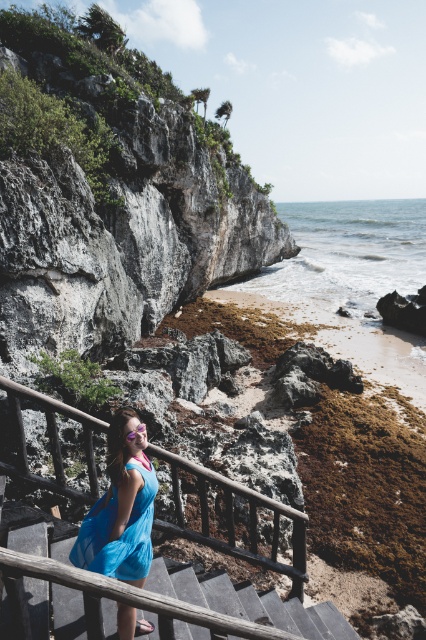
You are a tourist standing at the top of the wooden stairs at center. You want to walk down to the beach. Which direction should you go relative to the wooden at center?

The wooden at center is positioned under the wooden stairs at center, so you should go in the direction away from the wooden at center to reach the beach.

You are a photographer positioned at the origin point of the image. You need to capture a shot of the blue fabric dress at center. Given that the dress is located at point 0.794, 0.284, can you determine its position relative to the center of the image?

The blue fabric dress at center is located at coordinates 0.794 on the x axis and 0.284 on the y axis, which places it slightly to the right and above the center of the image.